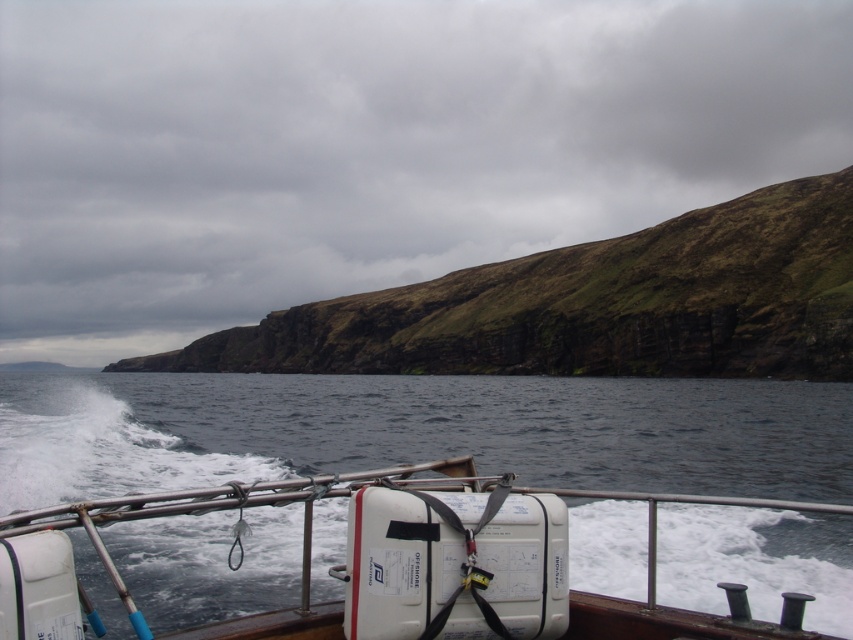
You are standing on the boat and looking at the green grassy cliff at upper center and the white plastic container at center. Which object is positioned to the left of the other?

The green grassy cliff at upper center is positioned to the left of the white plastic container at center.

You are standing on the boat and want to secure the white plastic container at center to the railing. The container needs to be placed below the green grassy cliff at upper center to avoid blocking the view. Can you do this?

The green grassy cliff at upper center is taller than the white plastic container at center, so placing the container below the cliff would still allow it to be visible and not block the view. Yes, you can secure the white plastic container at center below the green grassy cliff at upper center.

You are on a boat and looking at the green grassy cliff at upper center and the white plastic container at center. Which object is closer to you?

The white plastic container at center is behind the green grassy cliff at upper center, so the green grassy cliff at upper center is closer to you.